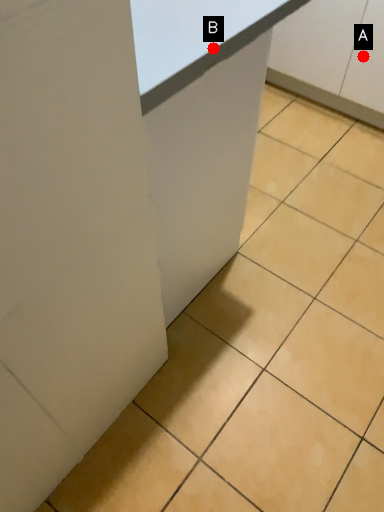
Question: Two points are circled on the image, labeled by A and B beside each circle. Which of the following is the farthest from the observer?

Choices:
 (A) A is further
 (B) B is further

Answer: (A)